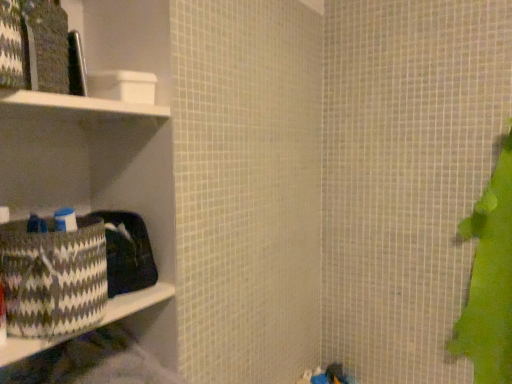
Question: Considering their positions, is patterned fabric basket at left located in front of or behind patterned woven basket at left?

Choices:
 (A) front
 (B) behind

Answer: (B)

Question: Considering the positions of point (121, 297) and point (20, 276), is point (121, 297) closer or farther from the camera than point (20, 276)?

Choices:
 (A) farther
 (B) closer

Answer: (A)

Question: Which is nearer to the patterned woven basket at left?

Choices:
 (A) white matte cabinet at upper left
 (B) patterned fabric basket at left

Answer: (B)

Question: Which object is the closest to the white matte cabinet at upper left?

Choices:
 (A) patterned woven basket at left
 (B) patterned fabric basket at left

Answer: (A)